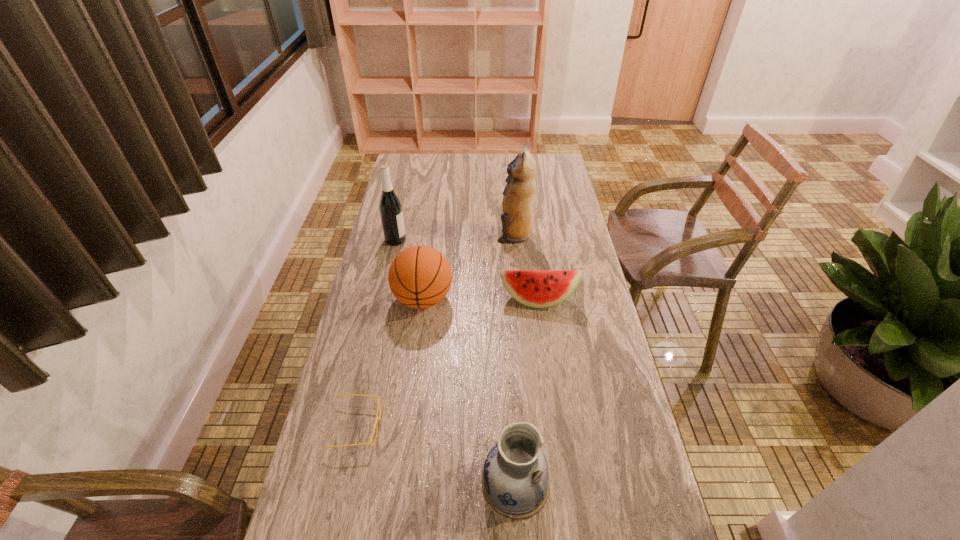
Find the location of a particular element. This screenshot has width=960, height=540. vacant region located 0.160m on the back of the pottery is located at coordinates (510, 393).

This screenshot has width=960, height=540. I want to click on vacant area situated 0.220m on the back of the basketball, so click(x=431, y=240).

This screenshot has width=960, height=540. I want to click on free region located on the outer rind of the watermelon, so click(547, 373).

You are a GUI agent. You are given a task and a screenshot of the screen. Output one action in this format:
    pyautogui.click(x=<x>, y=<y>)
    Task: Click on the vacant space located 0.250m in front of the lenses of the shortest object
    The height and width of the screenshot is (540, 960).
    Given the screenshot: What is the action you would take?
    pyautogui.click(x=477, y=427)

This screenshot has width=960, height=540. I want to click on wine bottle at the left edge, so click(390, 207).

I want to click on basketball positioned at the left edge, so click(419, 276).

At what (x,y) coordinates should I click in order to perform the action: click on spectacles that is positioned at the left edge. Please return your answer as a coordinate pair (x, y). Looking at the image, I should click on point(379,405).

Where is `object at the right edge`? This screenshot has height=540, width=960. object at the right edge is located at coordinates (535, 288).

I want to click on free region at the far edge, so click(x=474, y=161).

In the image, there is a desktop. Identify the location of free space at the left edge. click(404, 186).